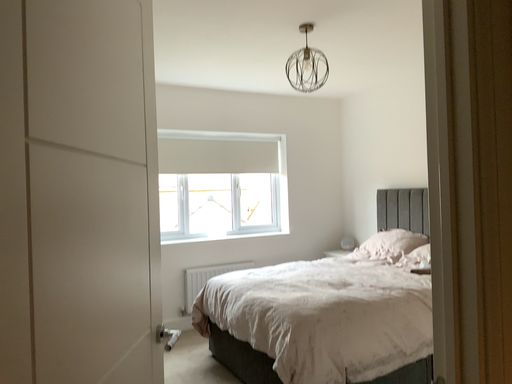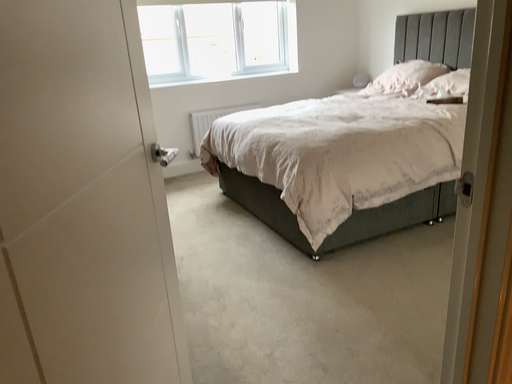
Question: Which way did the camera rotate in the video?

Choices:
 (A) rotated upward
 (B) rotated downward

Answer: (B)